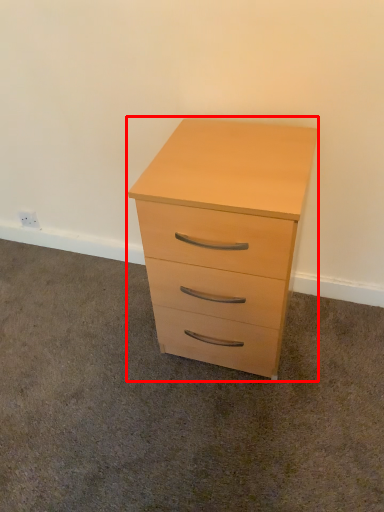
Question: In this image, where is chest of drawers (annotated by the red box) located relative to plain?

Choices:
 (A) left
 (B) right

Answer: (B)